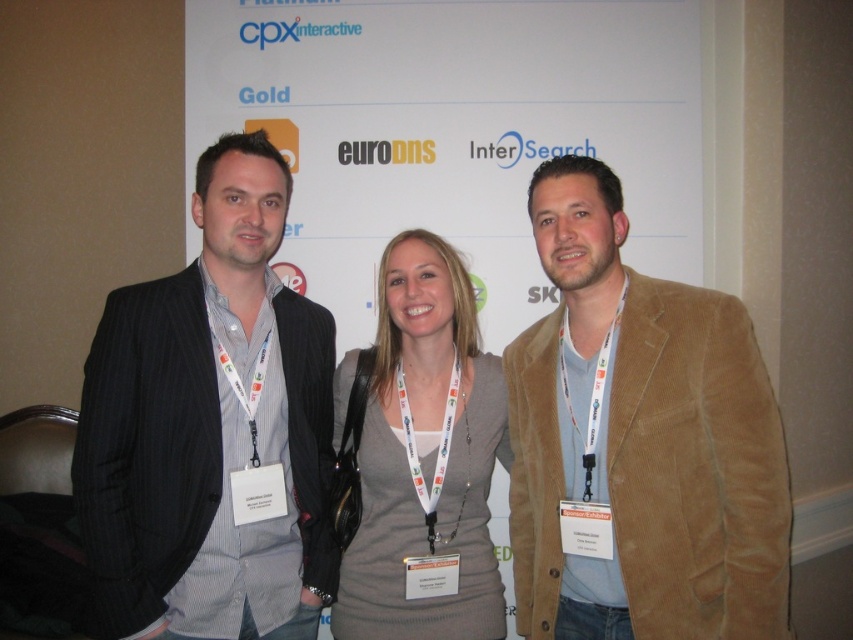
Looking at this image, you are organizing a photo shoot and need to ensure all participants are visible in the frame. Given that the dark gray pinstripe suit at left and the white fabric lanyard at right are part of the scene, which object takes up more space in the image?

The dark gray pinstripe suit at left is larger in size than the white fabric lanyard at right, so it takes up more space in the image.